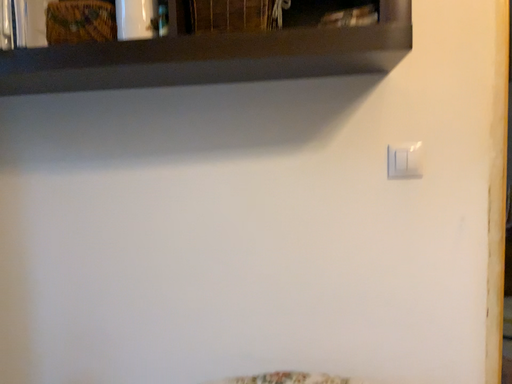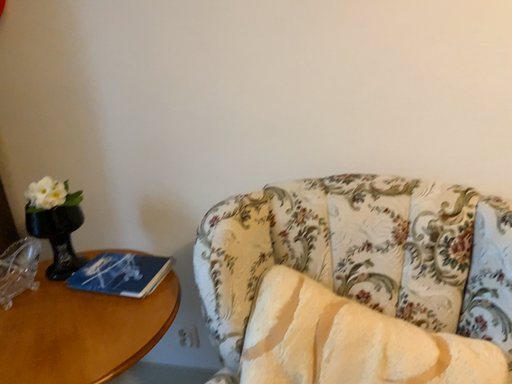
Question: How did the camera likely rotate when shooting the video?

Choices:
 (A) rotated upward
 (B) rotated downward

Answer: (B)